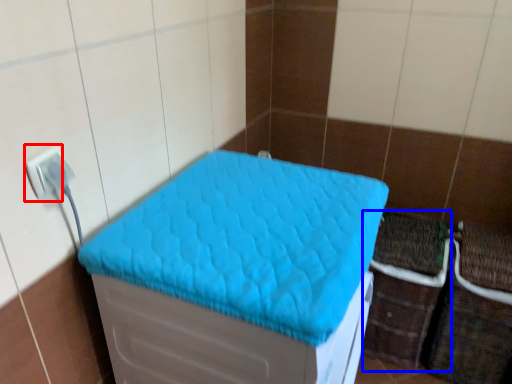
Question: Which of the following is the farthest to the observer, electric outlet (highlighted by a red box) or crate (highlighted by a blue box)?

Choices:
 (A) electric outlet
 (B) crate

Answer: (B)